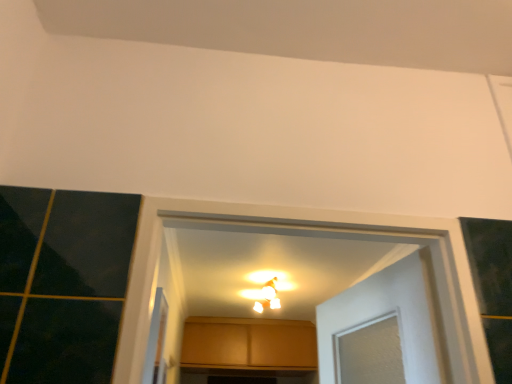
Question: Is clear plastic screen door at lower left located outside matte white light fixture at center?

Choices:
 (A) no
 (B) yes

Answer: (B)

Question: Is clear plastic screen door at lower left far from matte white light fixture at center?

Choices:
 (A) no
 (B) yes

Answer: (B)

Question: Is clear plastic screen door at lower left bigger than matte white light fixture at center?

Choices:
 (A) no
 (B) yes

Answer: (A)

Question: Is clear plastic screen door at lower left turned away from matte white light fixture at center?

Choices:
 (A) no
 (B) yes

Answer: (A)

Question: Can you confirm if clear plastic screen door at lower left is smaller than matte white light fixture at center?

Choices:
 (A) no
 (B) yes

Answer: (B)

Question: Is clear plastic screen door at lower left further to the viewer compared to matte white light fixture at center?

Choices:
 (A) yes
 (B) no

Answer: (B)

Question: From the image's perspective, is matte white light fixture at center over clear plastic screen door at lower left?

Choices:
 (A) yes
 (B) no

Answer: (B)

Question: Can you confirm if matte white light fixture at center is bigger than clear plastic screen door at lower left?

Choices:
 (A) yes
 (B) no

Answer: (A)

Question: Is clear plastic screen door at lower left a part of matte white light fixture at center?

Choices:
 (A) yes
 (B) no

Answer: (B)

Question: From a real-world perspective, is matte white light fixture at center over clear plastic screen door at lower left?

Choices:
 (A) yes
 (B) no

Answer: (A)

Question: From the image's perspective, is matte white light fixture at center under clear plastic screen door at lower left?

Choices:
 (A) yes
 (B) no

Answer: (A)

Question: Is matte white light fixture at center looking in the opposite direction of clear plastic screen door at lower left?

Choices:
 (A) no
 (B) yes

Answer: (A)

Question: Is clear plastic screen door at lower left shorter than matte wood cabinet at center?

Choices:
 (A) no
 (B) yes

Answer: (B)